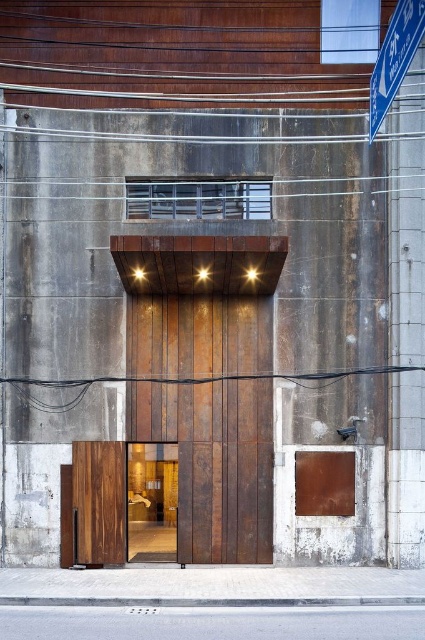
Question: Which object is positioned closest to the rustic wood door at center?

Choices:
 (A) rusty wood elevator at center
 (B) blue plastic street sign at upper right

Answer: (A)

Question: Does rustic wood door at center come in front of blue plastic street sign at upper right?

Choices:
 (A) yes
 (B) no

Answer: (B)

Question: Can you confirm if rusty wood elevator at center is positioned above rustic wood door at center?

Choices:
 (A) yes
 (B) no

Answer: (A)

Question: Is rusty wood elevator at center thinner than rustic wood door at center?

Choices:
 (A) yes
 (B) no

Answer: (B)

Question: Estimate the real-world distances between objects in this image. Which object is farther from the rustic wood door at center?

Choices:
 (A) blue plastic street sign at upper right
 (B) rusty wood elevator at center

Answer: (A)

Question: Which of the following is the farthest from the observer?

Choices:
 (A) (172, 436)
 (B) (163, 548)
 (C) (408, 8)

Answer: (B)